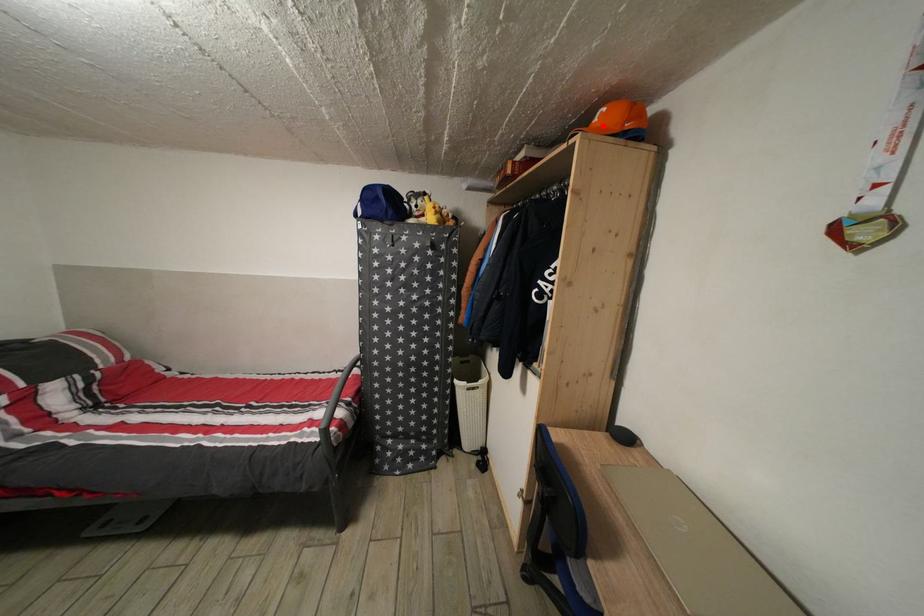
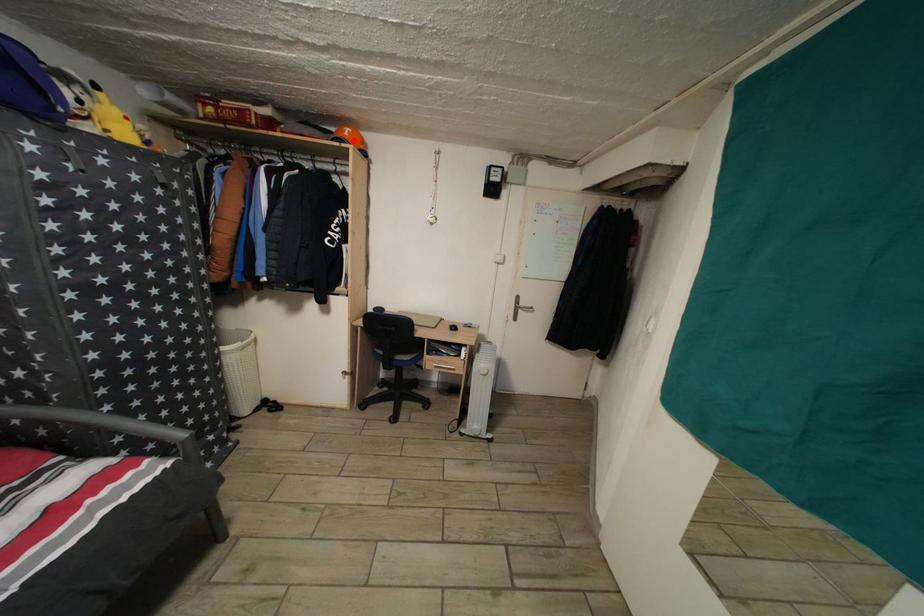
I am providing you with two images of the same scene from different viewpoints. A red point is marked on the first image and another point is marked on the second image. Do the highlighted points in image1 and image2 indicate the same real-world spot?

Yes